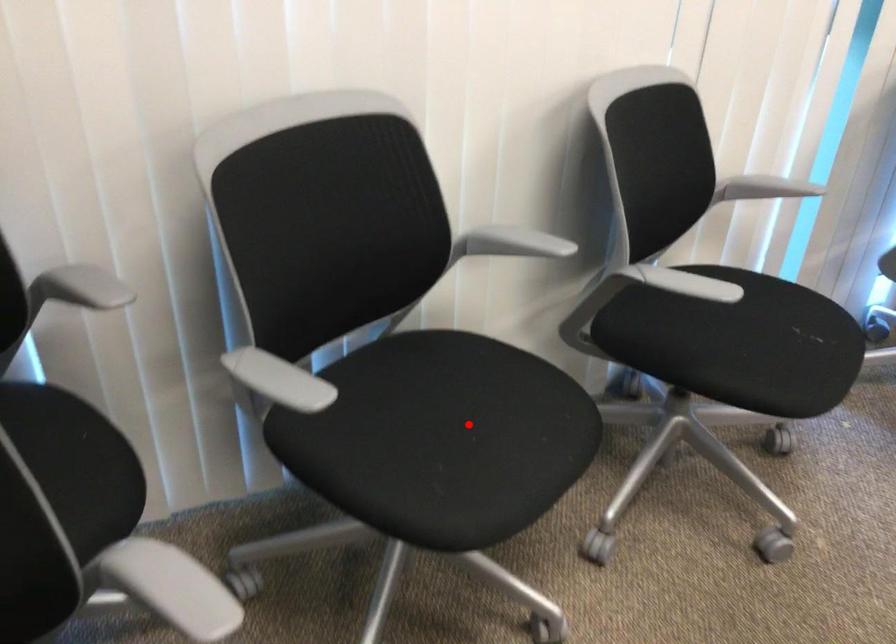
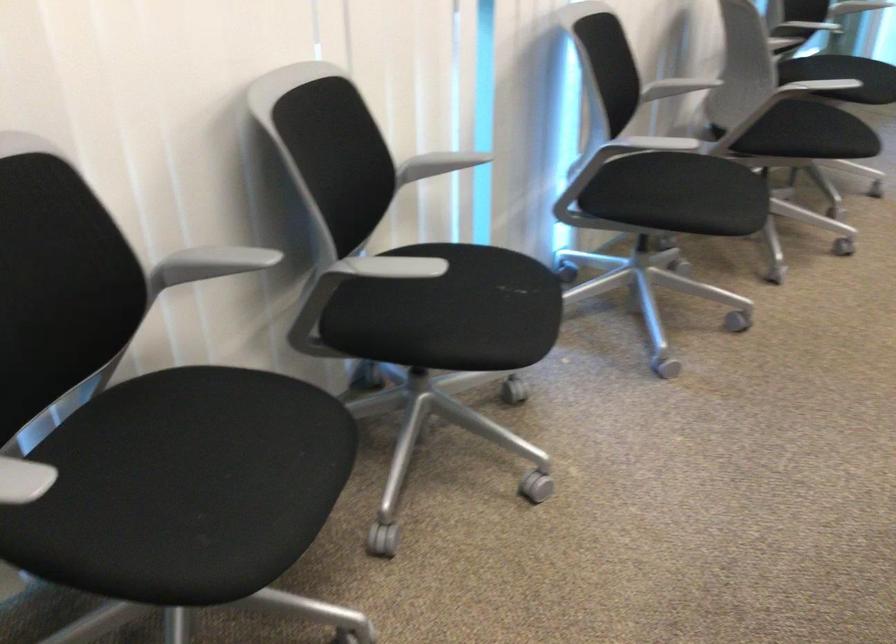
Locate, in the second image, the point that corresponds to the highlighted location in the first image.

(226, 456)